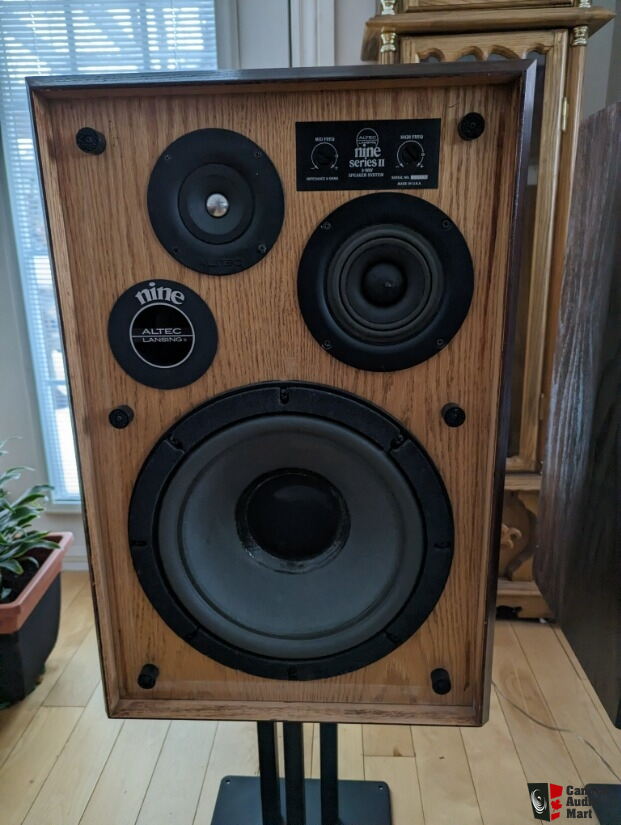
This screenshot has width=621, height=825. In order to click on smaller round parts of speaker in this screenshot , I will do `click(391, 290)`, `click(214, 184)`.